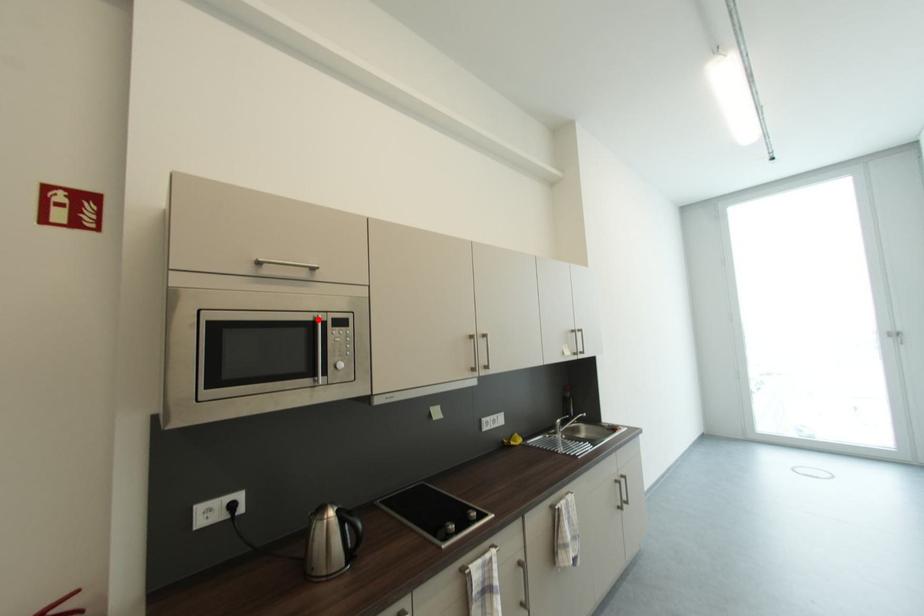
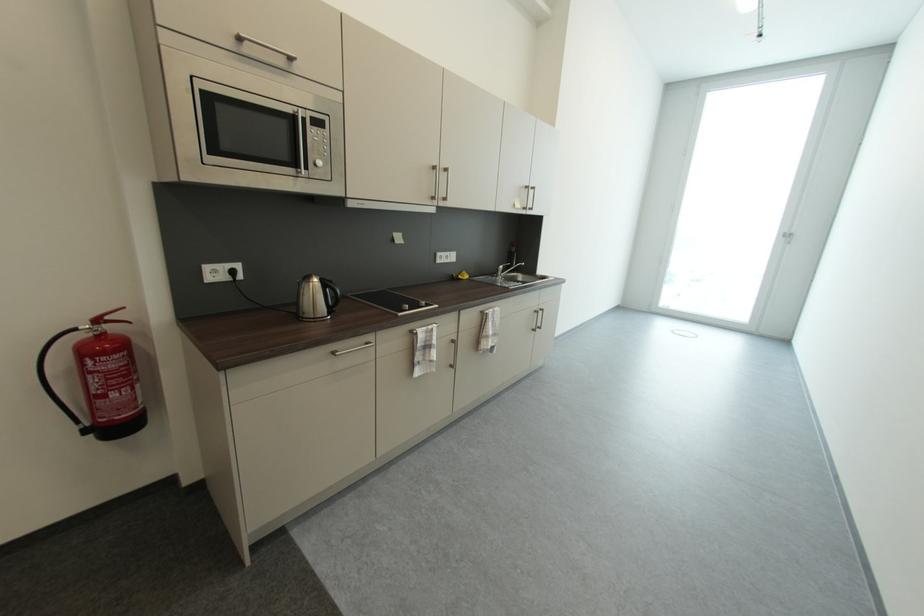
Find the pixel in the second image that matches the highlighted location in the first image.

(297, 113)